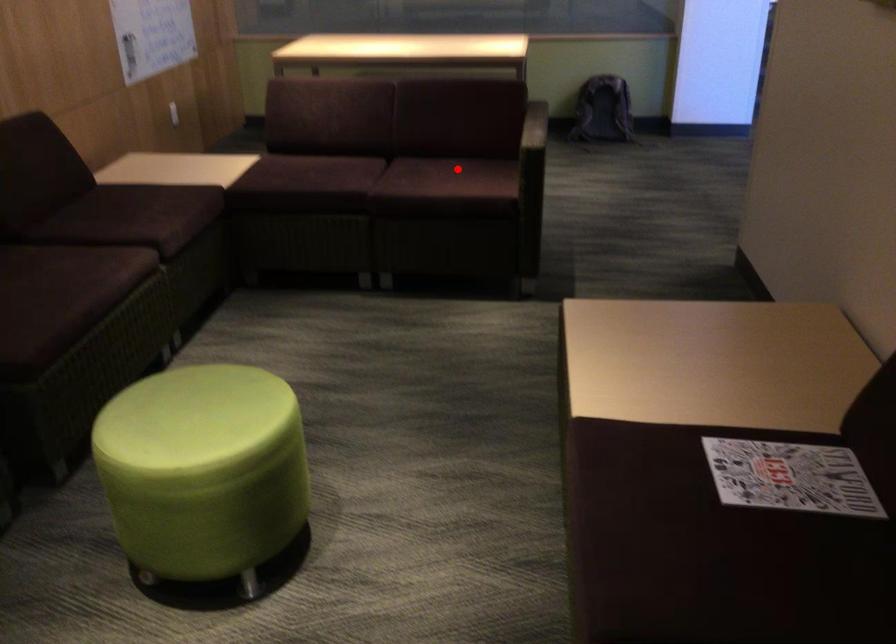
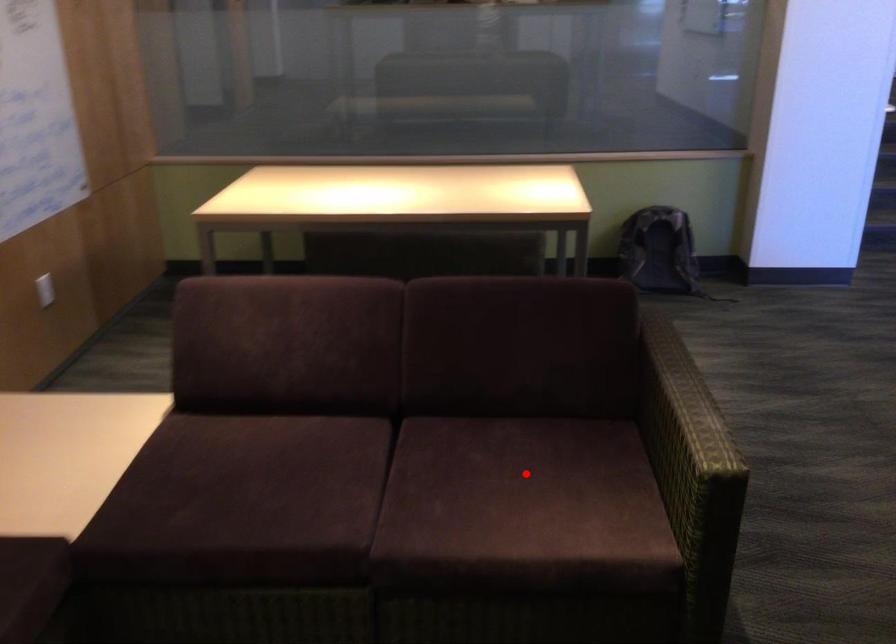
I am providing you with two images of the same scene from different viewpoints. A red point is marked on the first image and another point is marked on the second image. Do the highlighted points in image1 and image2 indicate the same real-world spot?

Yes